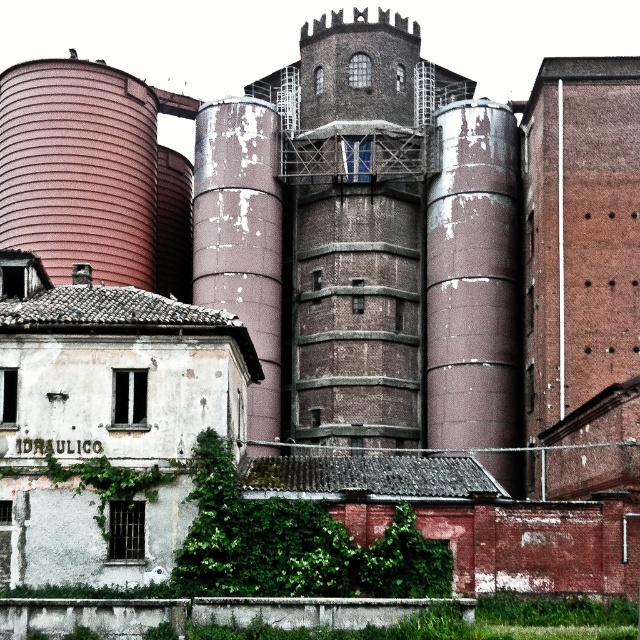
You are a maintenance worker inspecting the industrial area. You notice the green leafy plant at lower center and the rusty metal silo at center. Which object is positioned lower in the scene?

The green leafy plant at lower center is positioned lower than the rusty metal silo at center.

You are a maintenance worker inspecting the industrial site. You notice a green leafy plant at lower center and a green ivy at lower left. Which one is more to the right?

The green leafy plant at lower center is more to the right than the green ivy at lower left.